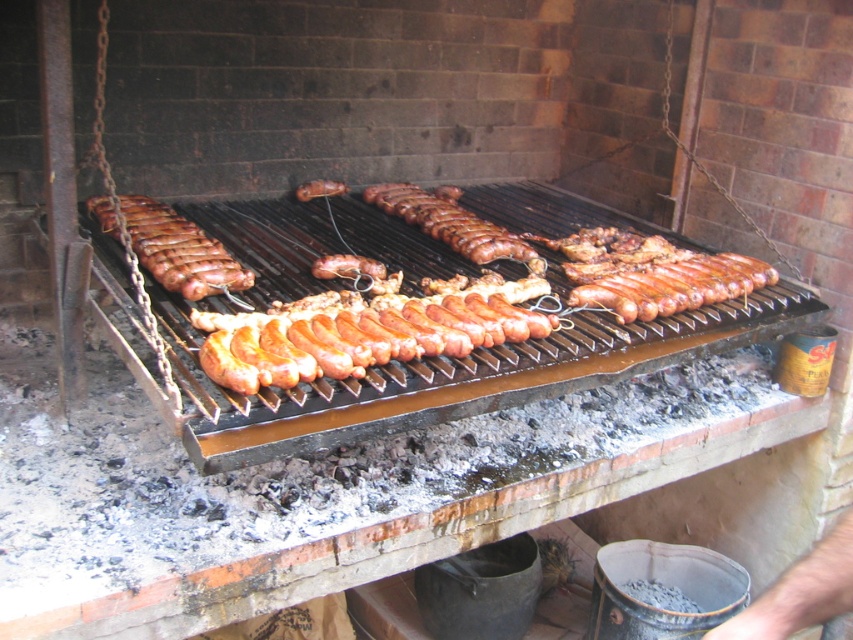
Image resolution: width=853 pixels, height=640 pixels. What are the coordinates of `brown glossy sausage at center` in the screenshot? It's located at (451, 221).

The image size is (853, 640). What do you see at coordinates (451, 221) in the screenshot?
I see `brown glossy sausage at center` at bounding box center [451, 221].

Where is `brown glossy sausage at center`? The image size is (853, 640). brown glossy sausage at center is located at coordinates (451, 221).

Is point (206, 282) farther from viewer compared to point (329, 186)?

No, it is in front of (329, 186).

Is shiny brown sausage at left taller than brown matte sausage at center?

Indeed, shiny brown sausage at left has a greater height compared to brown matte sausage at center.

Is point (131, 244) closer to viewer compared to point (332, 195)?

Yes, it is in front of point (332, 195).

Locate an element on the screen. The image size is (853, 640). shiny brown sausage at left is located at coordinates (180, 250).

Which is more to the left, shiny brown sausage at left or brown glossy sausage at center?

From the viewer's perspective, shiny brown sausage at left appears more on the left side.

Is shiny brown sausage at left shorter than brown glossy sausage at center?

Yes, shiny brown sausage at left is shorter than brown glossy sausage at center.

Locate an element on the screen. The width and height of the screenshot is (853, 640). shiny brown sausage at left is located at coordinates (180, 250).

Where is `shiny brown sausage at left`? This screenshot has height=640, width=853. shiny brown sausage at left is located at coordinates (180, 250).